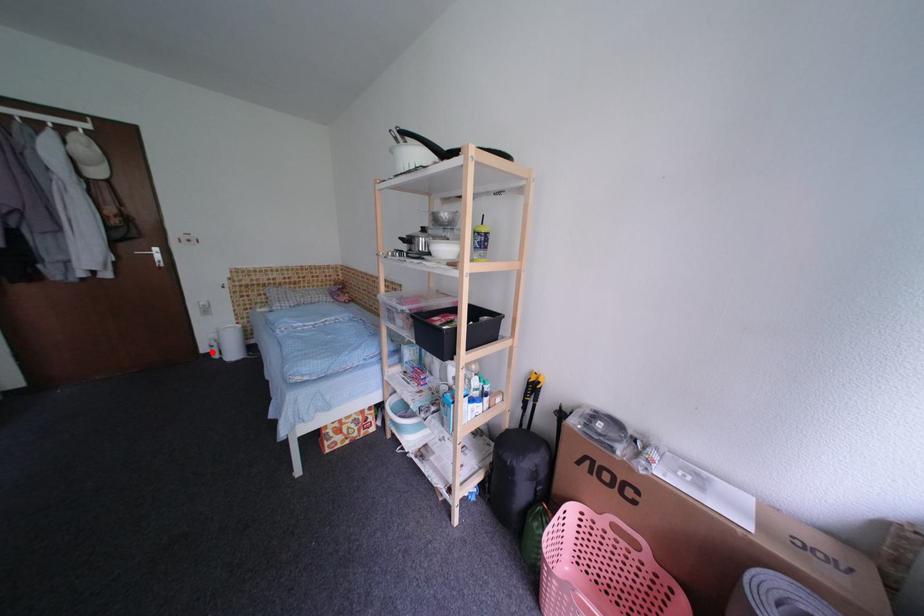
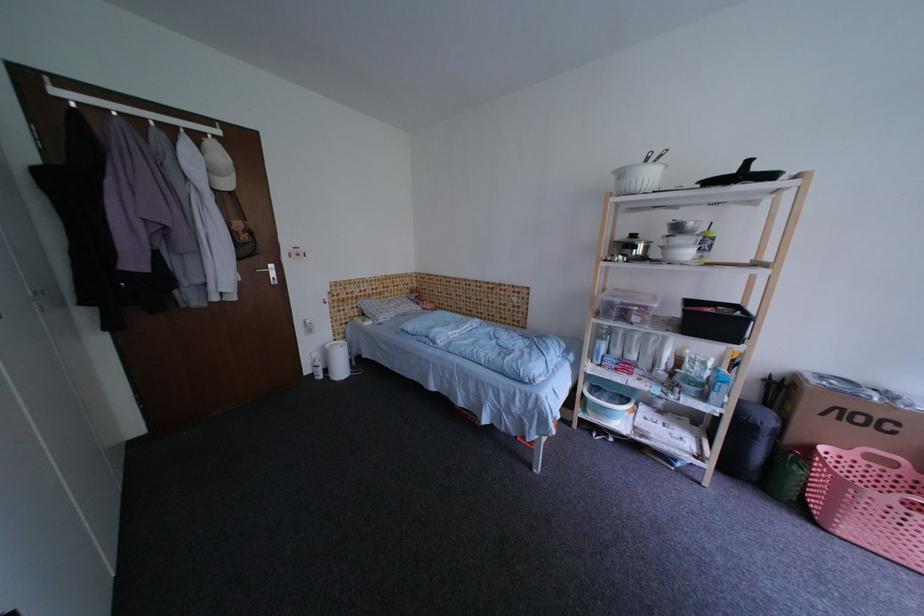
Find the pixel in the second image that matches the highlighted location in the first image.

(314, 374)